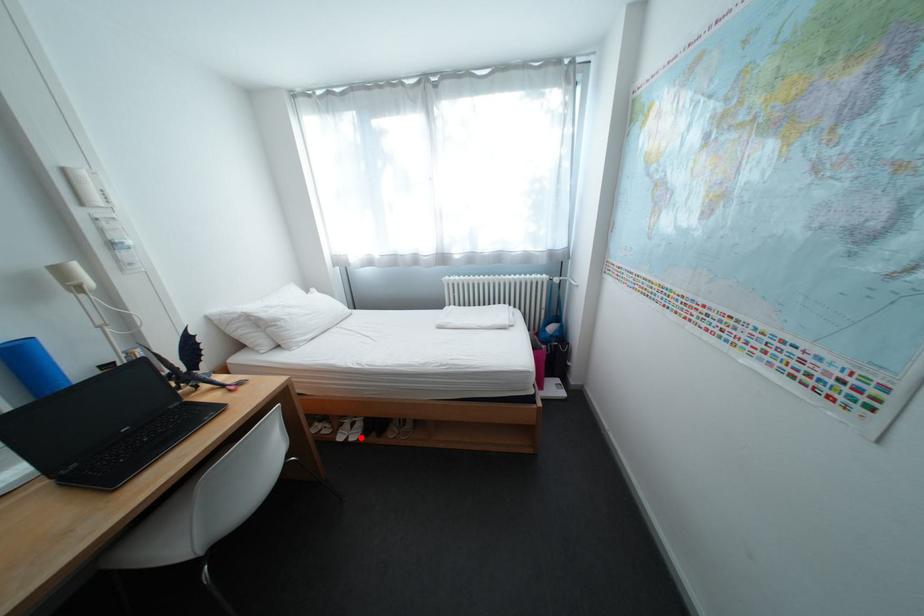
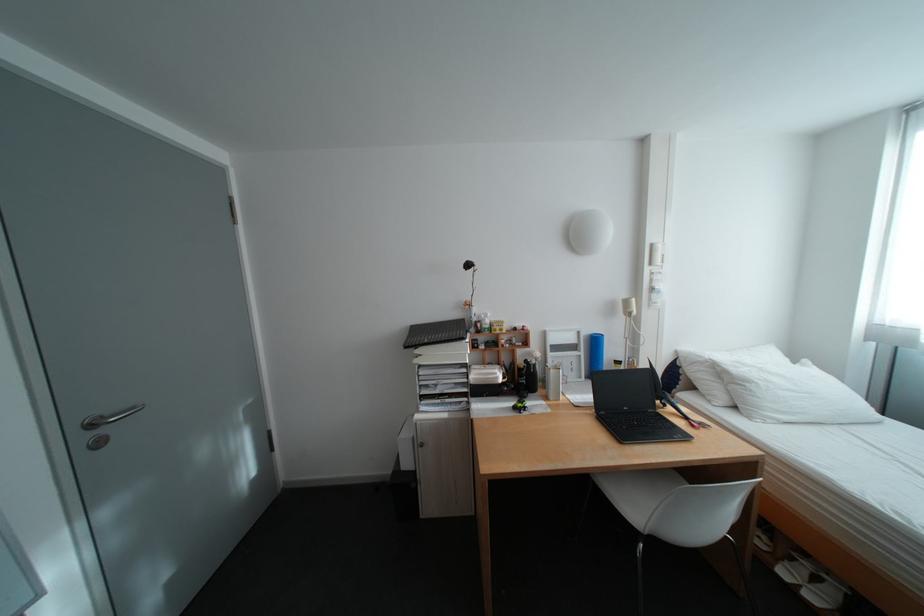
Question: I am providing you with two images of the same scene from different viewpoints. Image1 has a red point marked. In image2, the corresponding 3D location appears at what relative position? Reply with the corresponding letter.

Choices:
 (A) Closer
 (B) Farther

Answer: (A)